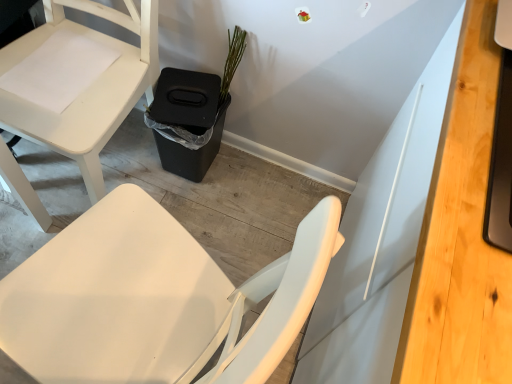
Question: In the image, is green matte plant at upper center positioned in front of or behind white matte chair at lower left?

Choices:
 (A) behind
 (B) front

Answer: (A)

Question: Based on their sizes in the image, would you say green matte plant at upper center is bigger or smaller than white matte chair at lower left?

Choices:
 (A) big
 (B) small

Answer: (B)

Question: Estimate the real-world distances between objects in this image. Which object is closer to the white matte chair at lower left?

Choices:
 (A) green matte plant at upper center
 (B) black plastic trash bin at lower center
 (C) light wood desk at right

Answer: (B)

Question: Which object is the closest to the black plastic trash bin at lower center?

Choices:
 (A) light wood desk at right
 (B) white matte chair at lower left
 (C) green matte plant at upper center

Answer: (C)